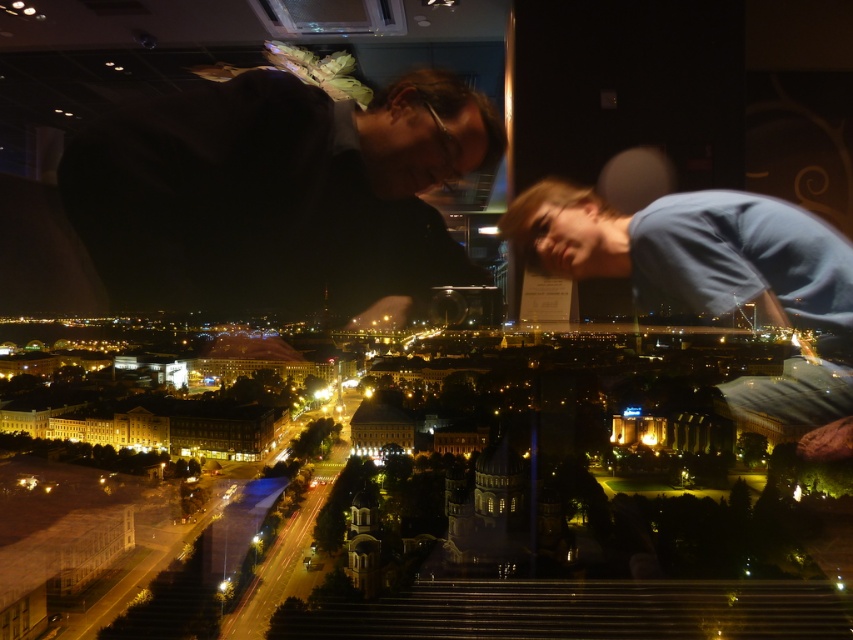
Is dark matte shirt at upper left shorter than blue cotton shirt at upper right?

Yes, dark matte shirt at upper left is shorter than blue cotton shirt at upper right.

In the scene shown: Who is lower down, dark matte shirt at upper left or blue cotton shirt at upper right?

blue cotton shirt at upper right

Which is behind, point (434, 150) or point (811, 291)?

Point (434, 150)

You are a GUI agent. You are given a task and a screenshot of the screen. Output one action in this format:
    pyautogui.click(x=<x>, y=<y>)
    Task: Click on the dark matte shirt at upper left
    
    Given the screenshot: What is the action you would take?
    pyautogui.click(x=276, y=193)